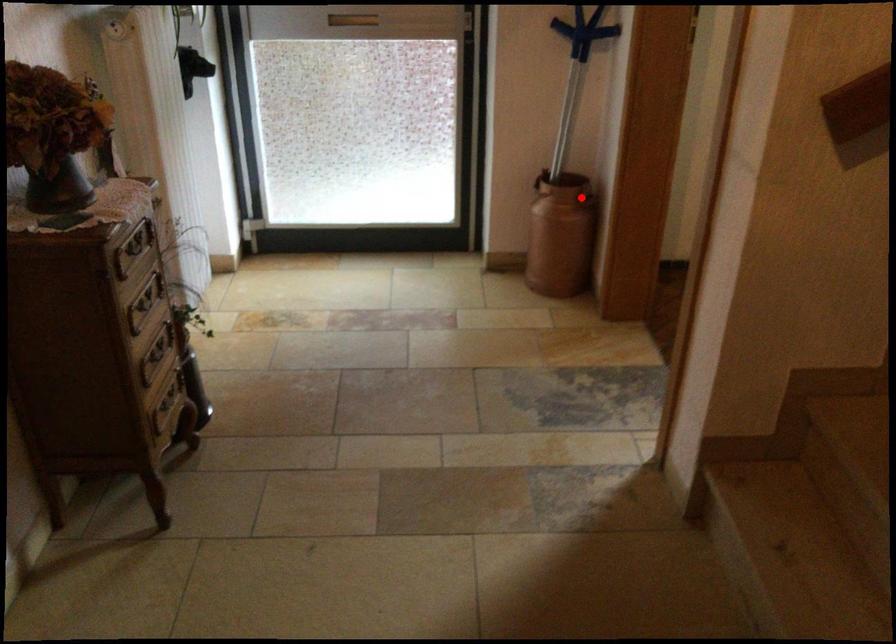
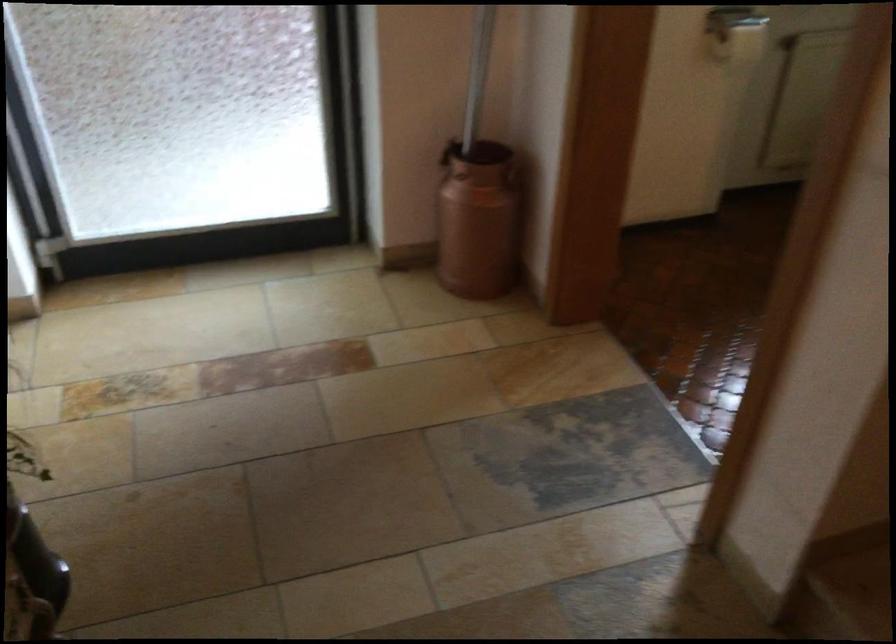
The point at the highlighted location is marked in the first image. Where is the corresponding point in the second image?

(513, 176)